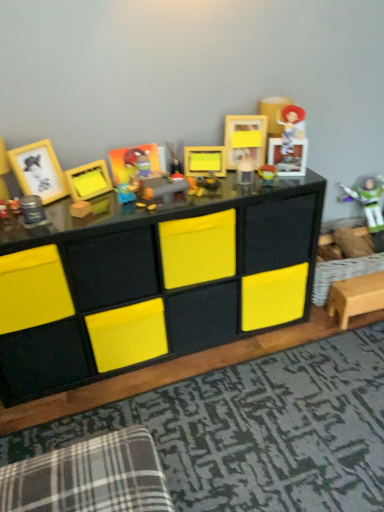
Question: Which direction should I rotate to look at yellow matte picture frame at center, the 4th picture frame from the left?

Choices:
 (A) left
 (B) right

Answer: (B)

Question: From the image's perspective, is metallic silver canister at left, which is the 5th toy in back-to-front order, located above matte plastic picture frame at center, the third picture frame viewed from the right?

Choices:
 (A) yes
 (B) no

Answer: (B)

Question: Does metallic silver canister at left, which is the 5th toy in back-to-front order, have a larger size compared to matte plastic picture frame at center, which ranks as the third picture frame in left-to-right order?

Choices:
 (A) yes
 (B) no

Answer: (B)

Question: Does metallic silver canister at left, the first toy when ordered from left to right, appear on the left side of matte plastic picture frame at center, which ranks as the third picture frame in left-to-right order?

Choices:
 (A) no
 (B) yes

Answer: (B)

Question: Is metallic silver canister at left, the fifth toy in the right-to-left sequence, at the right side of matte plastic picture frame at center, the third picture frame viewed from the right?

Choices:
 (A) yes
 (B) no

Answer: (B)

Question: Is metallic silver canister at left, the first toy when ordered from front to back, taller than matte plastic picture frame at center, which ranks as the third picture frame in left-to-right order?

Choices:
 (A) no
 (B) yes

Answer: (A)

Question: Considering the relative sizes of metallic silver canister at left, the fifth toy in the right-to-left sequence, and matte plastic picture frame at center, the third picture frame viewed from the right, in the image provided, is metallic silver canister at left, the fifth toy in the right-to-left sequence, smaller than matte plastic picture frame at center, the third picture frame viewed from the right,?

Choices:
 (A) yes
 (B) no

Answer: (A)

Question: From the image's perspective, is plaid fabric swivel chair at lower left beneath plastic buzz lightyear at right, which is the 1th toy from back to front?

Choices:
 (A) yes
 (B) no

Answer: (A)

Question: Is plaid fabric swivel chair at lower left positioned before plastic buzz lightyear at right, which appears as the fifth toy when viewed from the front?

Choices:
 (A) yes
 (B) no

Answer: (A)

Question: From the image's perspective, is plaid fabric swivel chair at lower left on plastic buzz lightyear at right, which is counted as the first toy, starting from the right?

Choices:
 (A) yes
 (B) no

Answer: (B)

Question: Does plaid fabric swivel chair at lower left have a greater width compared to plastic buzz lightyear at right, which is counted as the first toy, starting from the right?

Choices:
 (A) yes
 (B) no

Answer: (A)

Question: Would you say plastic buzz lightyear at right, which is the 1th toy from back to front, is part of plaid fabric swivel chair at lower left's contents?

Choices:
 (A) yes
 (B) no

Answer: (B)

Question: Could you tell me if plaid fabric swivel chair at lower left is facing plastic buzz lightyear at right, which is the 1th toy from back to front?

Choices:
 (A) no
 (B) yes

Answer: (A)

Question: From the image's perspective, is matte plastic buzz lightyear at center, arranged as the 3th toy when viewed from the left, under black matte storage unit at center?

Choices:
 (A) yes
 (B) no

Answer: (B)